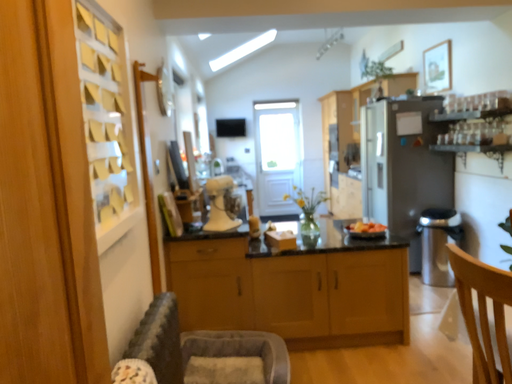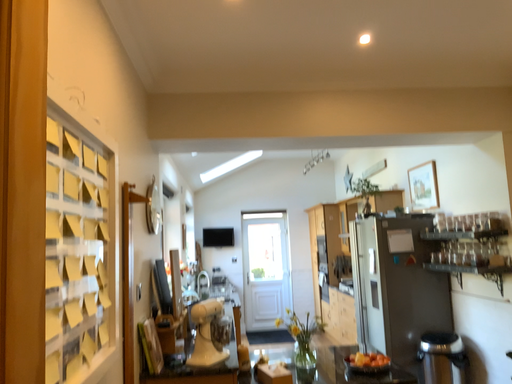
Question: Which way did the camera rotate in the video?

Choices:
 (A) rotated downward
 (B) rotated upward

Answer: (B)